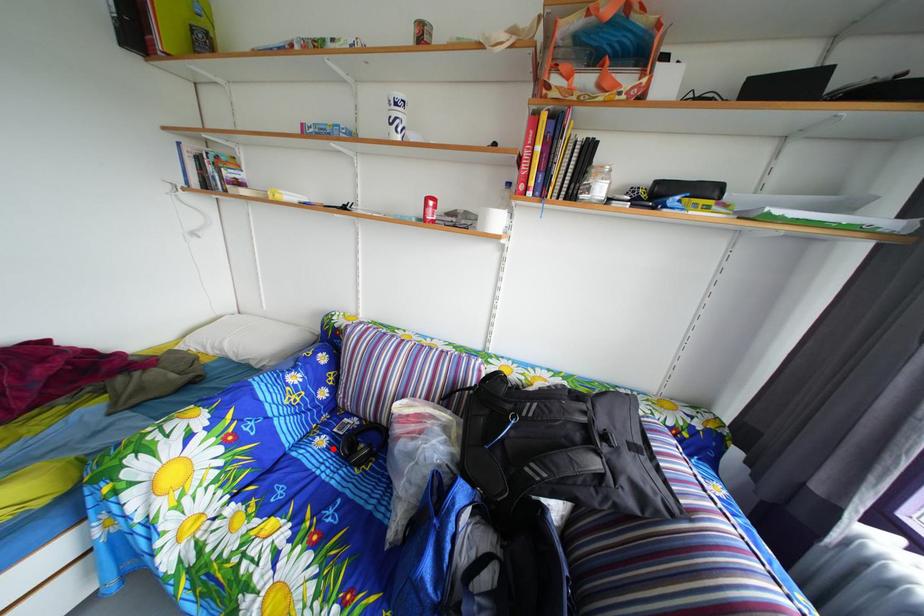
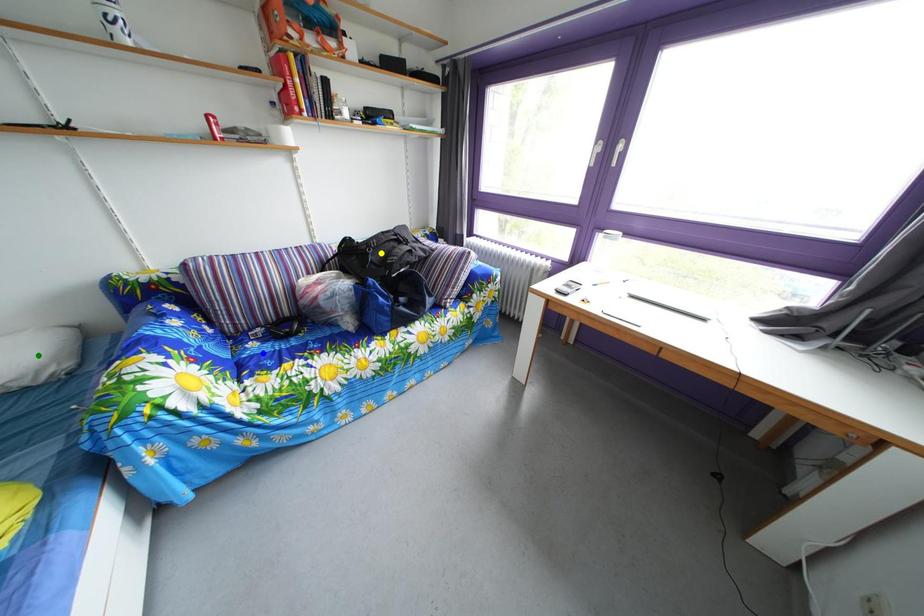
Question: I am providing you with two images of the same scene from different viewpoints. A red point is marked on the first image. You are given multiple points on the second image. Which spot in image 2 lines up with the point in image 1?

Choices:
 (A) green point
 (B) yellow point
 (C) blue point

Answer: (C)